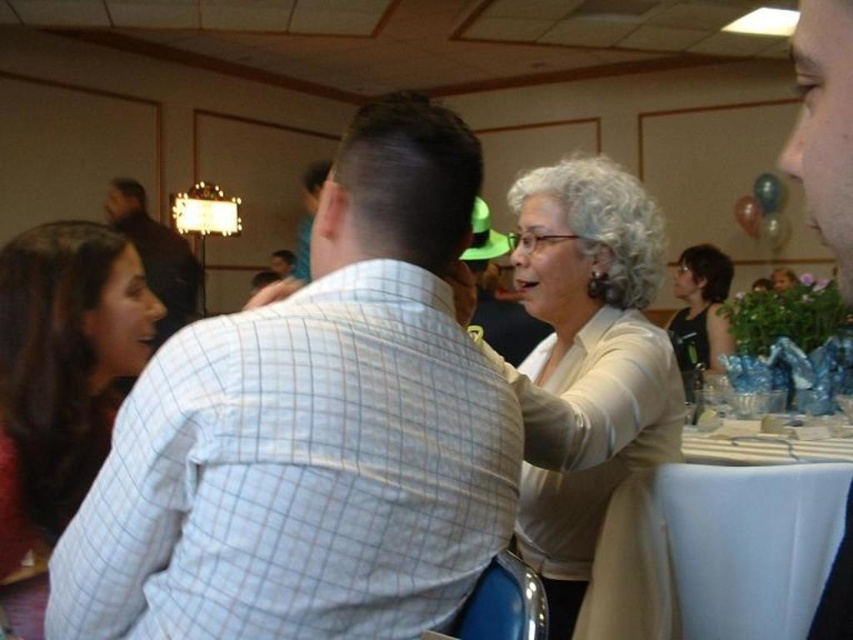
You are a photographer at the event and need to capture a group photo. You notice the dark brown hair at left and the black fabric tank top at right in your frame. Which of these two items has a narrower width in the image?

The dark brown hair at left has a narrower width than the black fabric tank top at right.

You are a photographer at the event and want to capture a photo that includes both the white checkered shirt at center and the black fabric tank top at right. Based on their positions, which one should you focus on first to ensure both are in the frame?

The white checkered shirt at center is located below the black fabric tank top at right, so you should focus on the black fabric tank top at right first to ensure both are in the frame.

You are a photographer at the event and want to capture a photo of the dark brown hair at left and the black fabric tank top at right. Based on their positions, which one is closer to the bottom of the image?

The dark brown hair at left is positioned under the black fabric tank top at right, so it is closer to the bottom of the image.